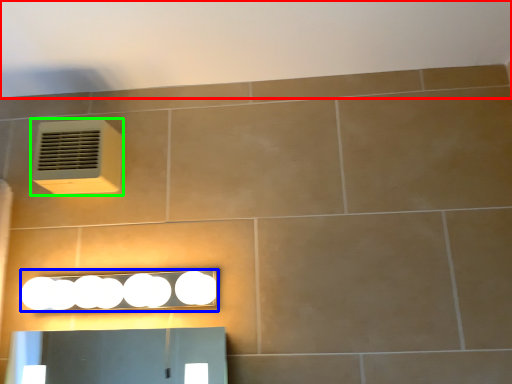
Question: Which object is positioned farthest from backdrop (highlighted by a red box)? Select from light fixture (highlighted by a blue box) and air conditioning (highlighted by a green box).

Choices:
 (A) light fixture
 (B) air conditioning

Answer: (A)